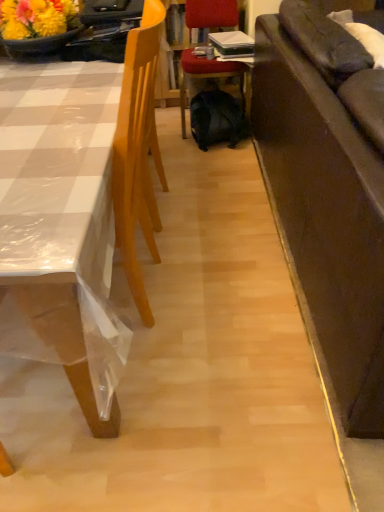
Question: From a real-world perspective, is black matte backpack at center positioned above or below velvet red chair at center, arranged as the 1th chair when viewed from the right?

Choices:
 (A) below
 (B) above

Answer: (A)

Question: Is point (230, 122) positioned closer to the camera than point (228, 74)?

Choices:
 (A) closer
 (B) farther

Answer: (A)

Question: Estimate the real-world distances between objects in this image. Which object is farther from the black matte backpack at center?

Choices:
 (A) light wood chair at left, the 2th chair when ordered from right to left
 (B) velvet red chair at center, arranged as the 1th chair when viewed from the right
 (C) dark brown leather couch at right

Answer: (A)

Question: Which of these objects is positioned closest to the black matte backpack at center?

Choices:
 (A) velvet red chair at center, placed as the second chair when sorted from left to right
 (B) light wood chair at left, the 2th chair when ordered from right to left
 (C) dark brown leather couch at right

Answer: (A)